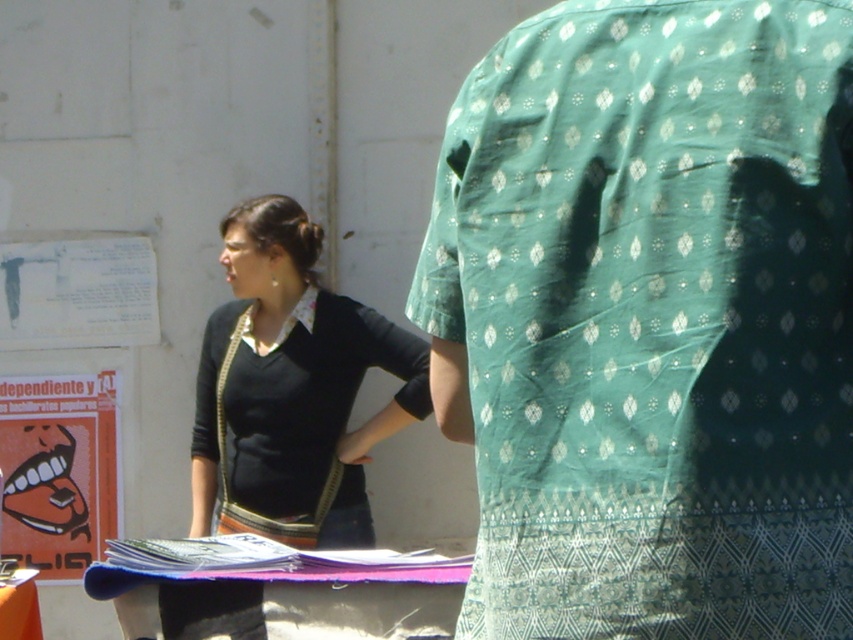
Question: Is green printed fabric at center smaller than black jersey at center?

Choices:
 (A) yes
 (B) no

Answer: (A)

Question: Which object appears farthest from the camera in this image?

Choices:
 (A) green printed fabric at center
 (B) black jersey at center

Answer: (B)

Question: Does green printed fabric at center appear on the left side of black jersey at center?

Choices:
 (A) no
 (B) yes

Answer: (A)

Question: Does green printed fabric at center have a lesser width compared to black jersey at center?

Choices:
 (A) yes
 (B) no

Answer: (A)

Question: Which of the following is the farthest from the observer?

Choices:
 (A) black jersey at center
 (B) green printed fabric at center

Answer: (A)

Question: Among these objects, which one is farthest from the camera?

Choices:
 (A) green printed fabric at center
 (B) black jersey at center

Answer: (B)